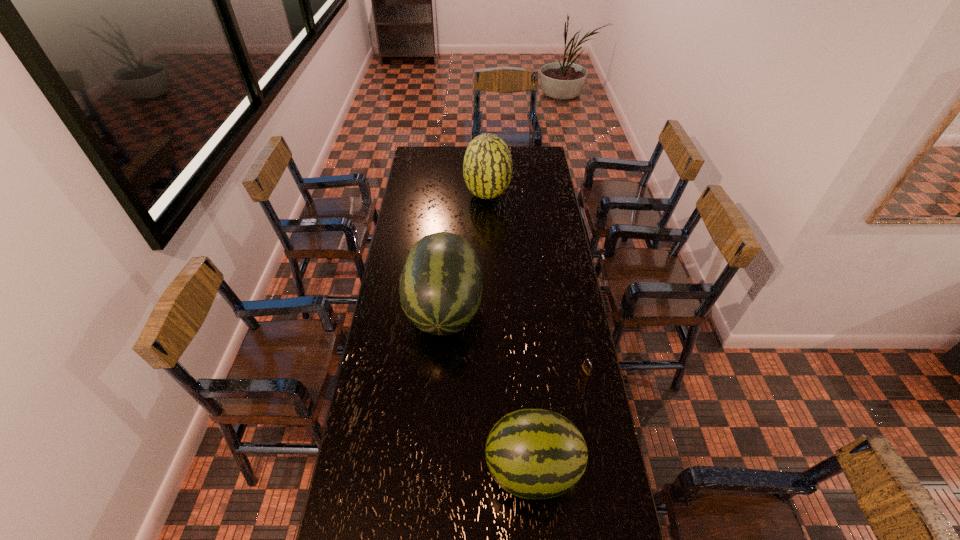
Where is `the farthest object`? The width and height of the screenshot is (960, 540). the farthest object is located at coordinates (487, 167).

Locate an element on the screen. the second farthest object is located at coordinates (441, 281).

At what (x,y) coordinates should I click in order to perform the action: click on the nearest object. Please return your answer as a coordinate pair (x, y). The image size is (960, 540). Looking at the image, I should click on (531, 453).

I want to click on the nearest watermelon, so click(531, 453).

The height and width of the screenshot is (540, 960). What are the coordinates of `the rightmost object` in the screenshot? It's located at click(585, 373).

Identify the location of padlock. (585, 373).

At what (x,y) coordinates should I click in order to perform the action: click on vacant space located 0.220m on the left of the farthest object. Please return your answer as a coordinate pair (x, y). The width and height of the screenshot is (960, 540). Looking at the image, I should click on (422, 195).

Image resolution: width=960 pixels, height=540 pixels. In order to click on vacant point located 0.110m on the back of the second farthest watermelon in this screenshot , I will do `click(448, 255)`.

Locate an element on the screen. This screenshot has width=960, height=540. vacant space situated 0.400m at the stem end of the shortest watermelon is located at coordinates (353, 469).

What are the coordinates of `vacant region located at the stem end of the shortest watermelon` in the screenshot? It's located at pos(383,469).